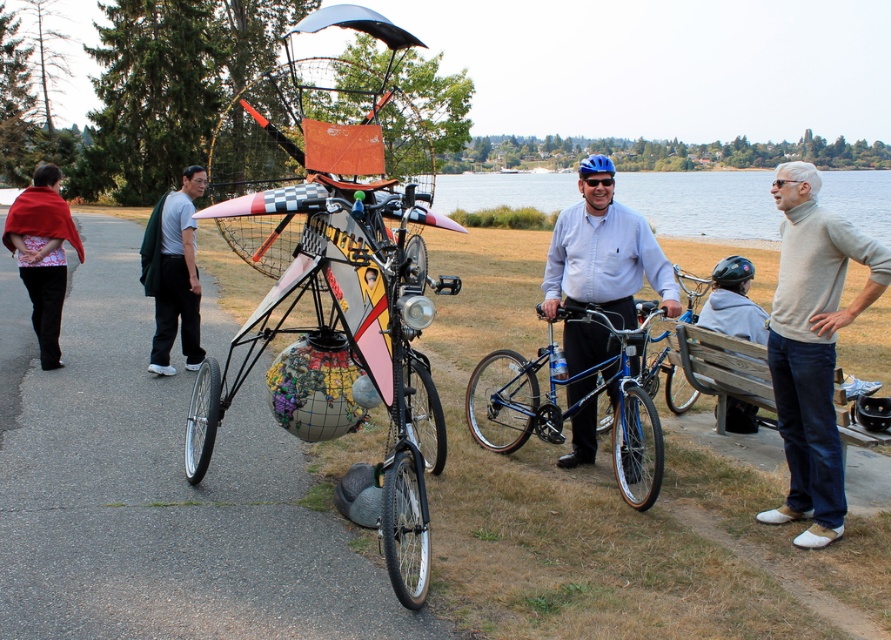
Based on the photo, you are organizing a hiking trip and need to pack your gear. You have a green fabric backpack at left and a gray fleece jacket at lower right. Which item has a smaller width and is better suited for packing tightly into a narrow space?

The green fabric backpack at left has a lesser width compared to the gray fleece jacket at lower right, so it is better suited for packing tightly into a narrow space.

You are a photographer trying to capture the gray sweater at right and the blue glossy shirt at center in a single photo. Based on their positions, which one would appear lower in the photo?

The gray sweater at right appears lower in the photo because it is positioned below the blue glossy shirt at center.